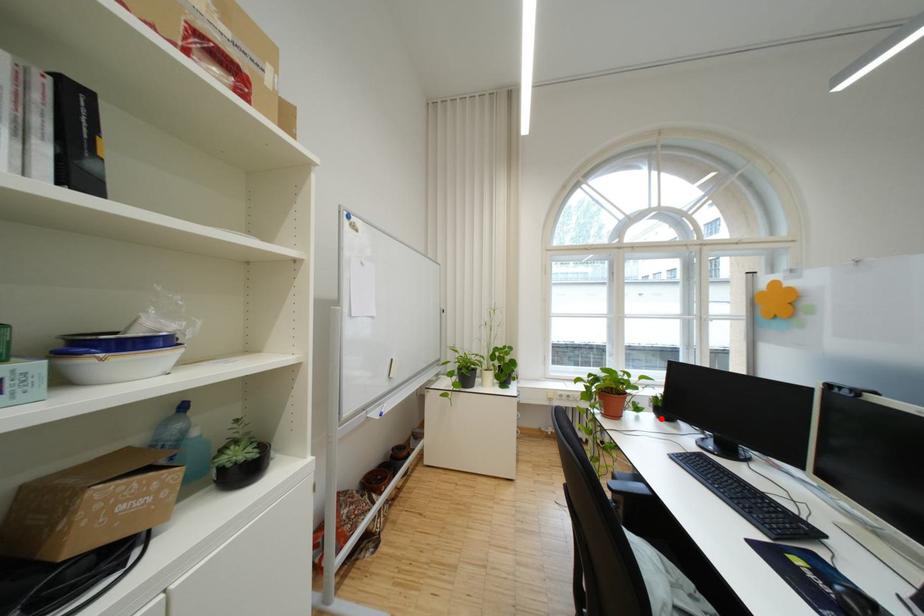
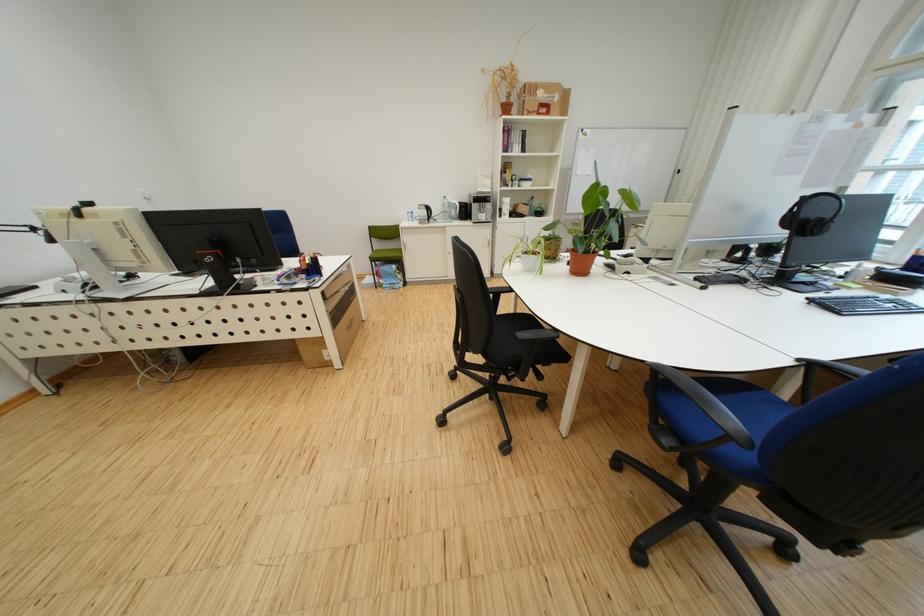
Question: I am providing you with two images of the same scene from different viewpoints. A red point is marked on the first image. Is the red point's position out of view in image 2?

Choices:
 (A) Yes
 (B) No

Answer: (A)